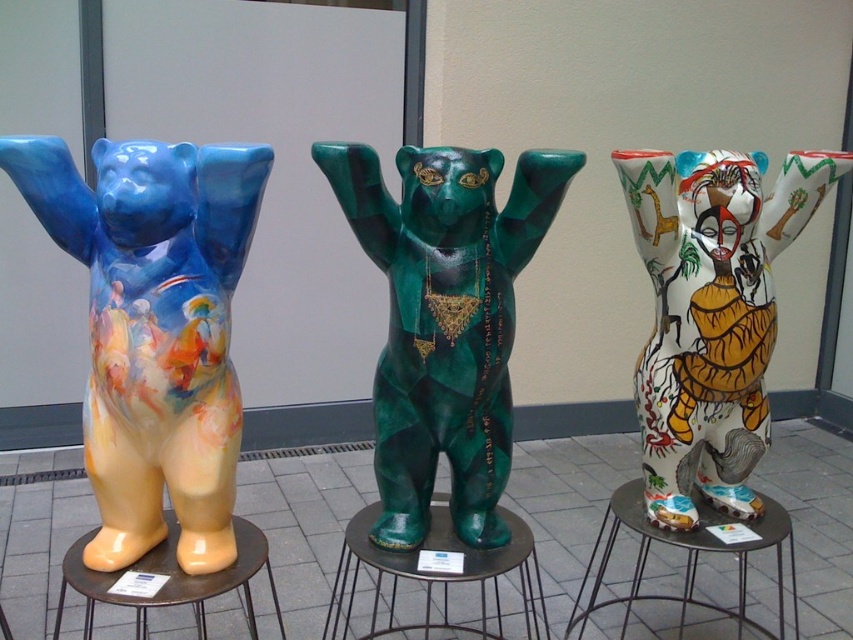
Does matte ceramic bear at left appear under metallic gray side table at center?

No.

The image size is (853, 640). What are the coordinates of `matte ceramic bear at left` in the screenshot? It's located at (154, 330).

Who is positioned more to the left, green glossy bear at center or green glossy boot at center?

green glossy bear at center

Who is shorter, green glossy bear at center or green glossy boot at center?

green glossy boot at center

This screenshot has height=640, width=853. Identify the location of green glossy bear at center. (445, 321).

The width and height of the screenshot is (853, 640). I want to click on green glossy bear at center, so click(x=445, y=321).

Does matte ceramic bear at left have a greater height compared to green glossy boot at center?

Yes, matte ceramic bear at left is taller than green glossy boot at center.

Can you confirm if matte ceramic bear at left is shorter than green glossy boot at center?

In fact, matte ceramic bear at left may be taller than green glossy boot at center.

Image resolution: width=853 pixels, height=640 pixels. What do you see at coordinates (154, 330) in the screenshot?
I see `matte ceramic bear at left` at bounding box center [154, 330].

Where is `matte ceramic bear at left`? The width and height of the screenshot is (853, 640). matte ceramic bear at left is located at coordinates (154, 330).